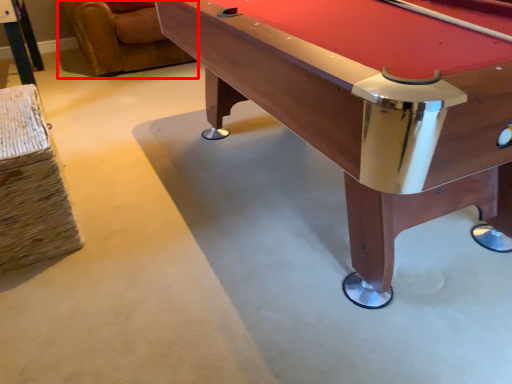
Question: Where is swivel chair (annotated by the red box) located in relation to billiard table in the image?

Choices:
 (A) left
 (B) right

Answer: (A)